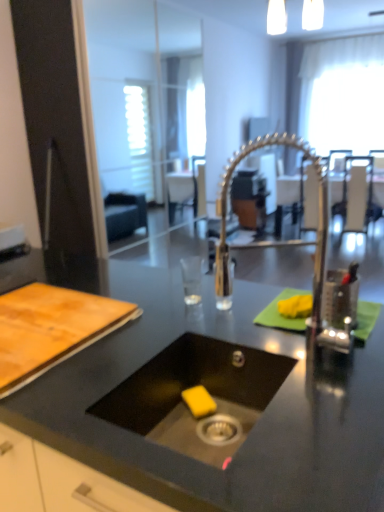
Question: Is black matte countertop at center wider than metallic silver chair at upper center, which is counted as the second chair, starting from the left?

Choices:
 (A) yes
 (B) no

Answer: (A)

Question: Can you confirm if black matte countertop at center is smaller than metallic silver chair at upper center, the 2th chair positioned from the right?

Choices:
 (A) yes
 (B) no

Answer: (B)

Question: Can you see black matte countertop at center touching metallic silver chair at upper center, which is counted as the second chair, starting from the left?

Choices:
 (A) yes
 (B) no

Answer: (B)

Question: Considering the relative positions of black matte countertop at center and metallic silver chair at upper center, the 2th chair positioned from the right, in the image provided, is black matte countertop at center to the right of metallic silver chair at upper center, the 2th chair positioned from the right, from the viewer's perspective?

Choices:
 (A) yes
 (B) no

Answer: (B)

Question: Is black matte countertop at center facing towards metallic silver chair at upper center, the 2th chair positioned from the right?

Choices:
 (A) yes
 (B) no

Answer: (A)

Question: From a real-world perspective, is black matte countertop at center below metallic silver chair at upper center, which is counted as the second chair, starting from the left?

Choices:
 (A) yes
 (B) no

Answer: (A)

Question: Considering the relative sizes of black matte countertop at center and white sheer curtain at upper right in the image provided, is black matte countertop at center wider than white sheer curtain at upper right?

Choices:
 (A) no
 (B) yes

Answer: (B)

Question: Can you confirm if black matte countertop at center is positioned to the right of white sheer curtain at upper right?

Choices:
 (A) no
 (B) yes

Answer: (A)

Question: Is black matte countertop at center touching white sheer curtain at upper right?

Choices:
 (A) yes
 (B) no

Answer: (B)

Question: From a real-world perspective, is black matte countertop at center on white sheer curtain at upper right?

Choices:
 (A) yes
 (B) no

Answer: (B)

Question: From the image's perspective, is black matte countertop at center located beneath white sheer curtain at upper right?

Choices:
 (A) yes
 (B) no

Answer: (A)

Question: Is black matte countertop at center smaller than white sheer curtain at upper right?

Choices:
 (A) no
 (B) yes

Answer: (A)

Question: Can you confirm if metallic silver chair at upper center, which is counted as the second chair, starting from the left, is smaller than metallic silver chair at center, the third chair from the right?

Choices:
 (A) yes
 (B) no

Answer: (B)